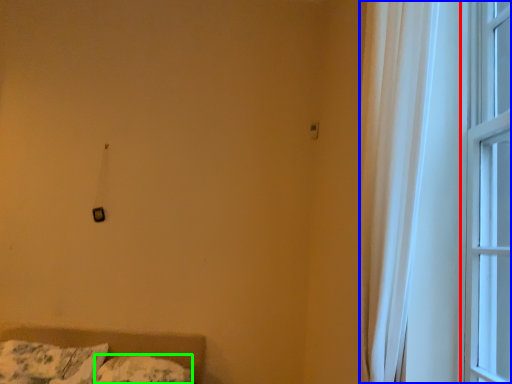
Question: Which is farther away from window (highlighted by a red box)? window (highlighted by a blue box) or pillow (highlighted by a green box)?

Choices:
 (A) window
 (B) pillow

Answer: (B)